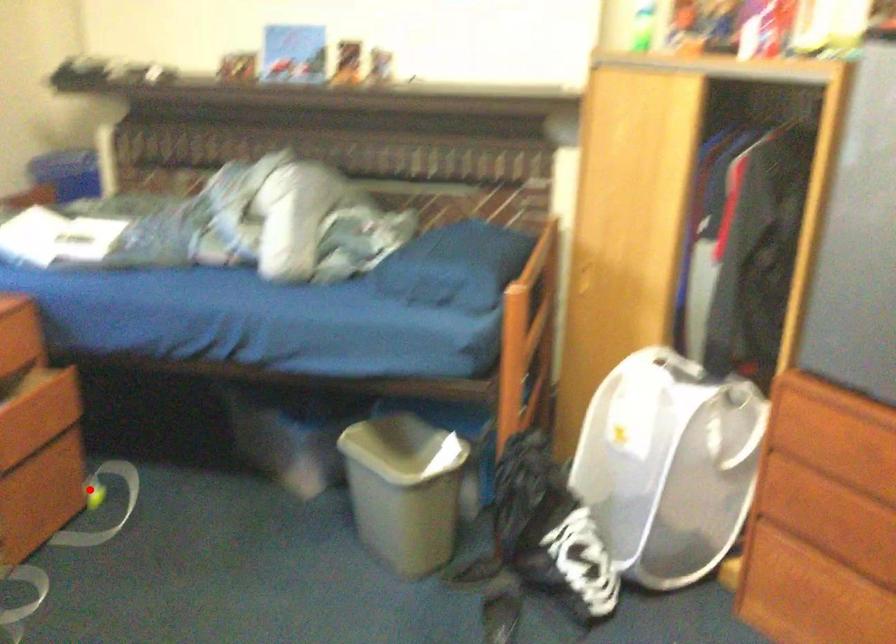
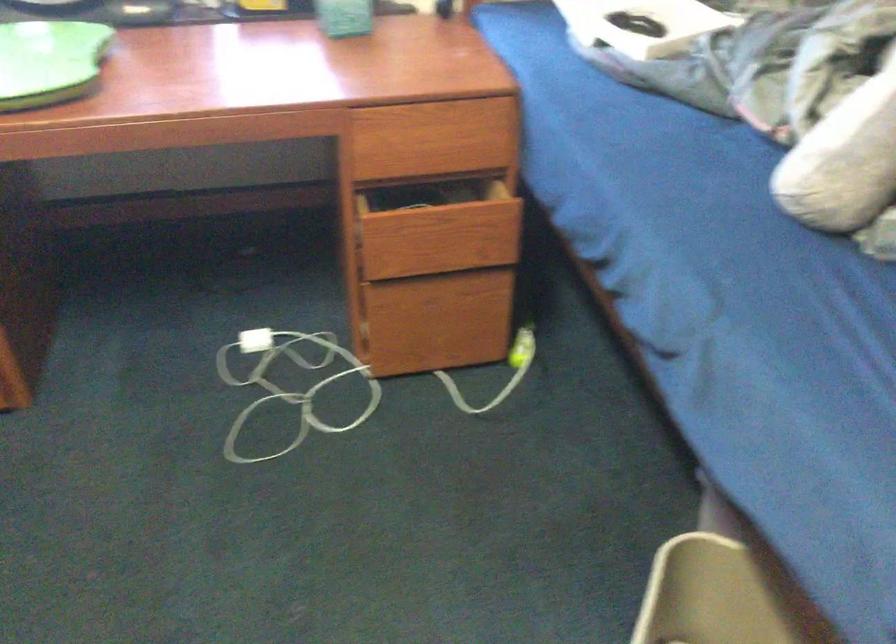
The point at the highlighted location is marked in the first image. Where is the corresponding point in the second image?

(521, 346)